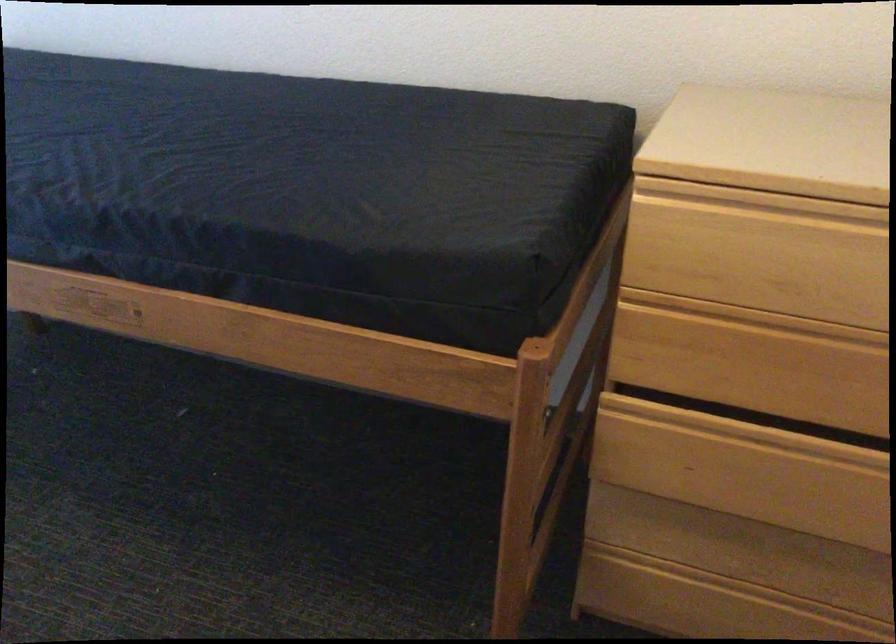
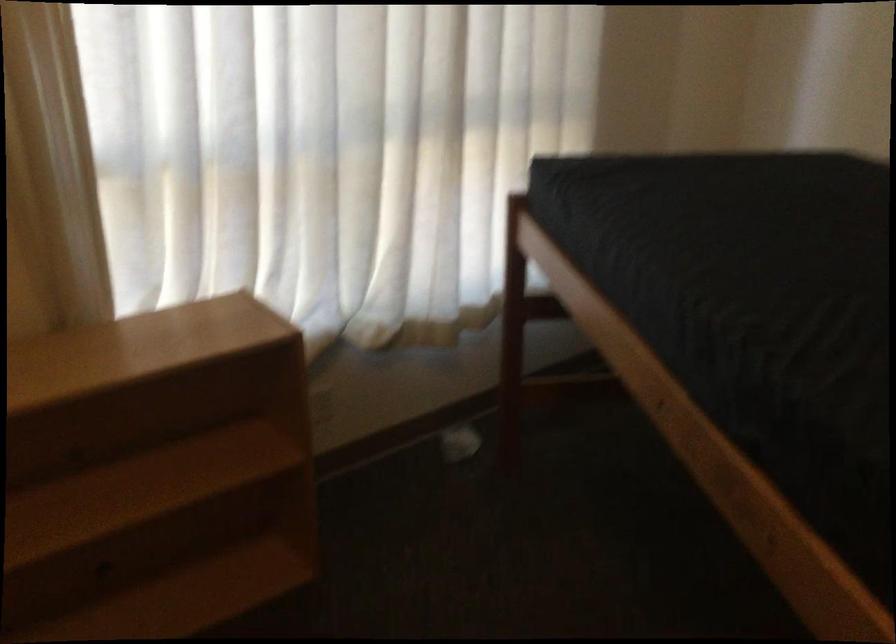
Question: How did the camera likely rotate?

Choices:
 (A) Left
 (B) Right
 (C) Up
 (D) Down

Answer: (A)